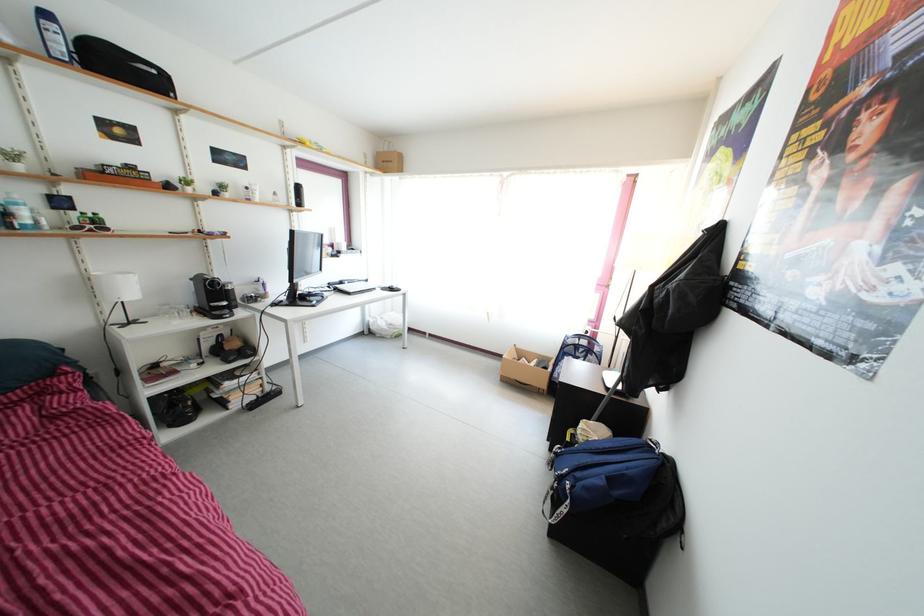
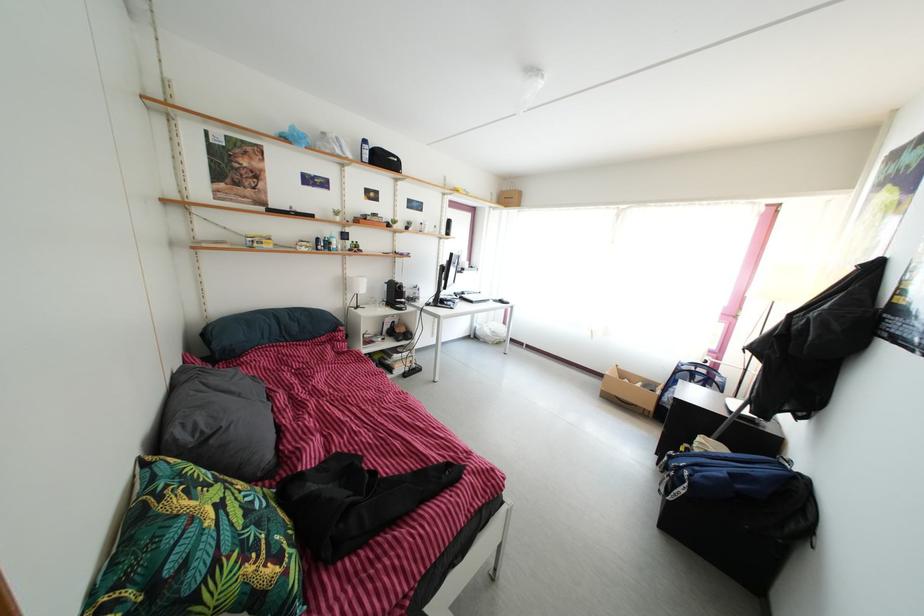
In the second image, find the point that corresponds to (234,355) in the first image.

(405, 339)